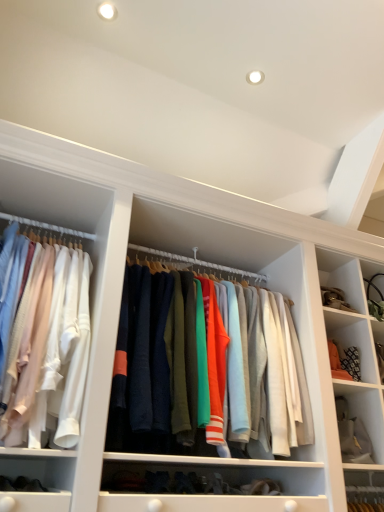
Question: Is there a large distance between white fabric at lower right and knit sweater at center, which is the 1th clothing from right to left?

Choices:
 (A) yes
 (B) no

Answer: (B)

Question: Does white fabric at lower right appear on the right side of knit sweater at center, which is the 1th clothing from right to left?

Choices:
 (A) no
 (B) yes

Answer: (B)

Question: Is white fabric at lower right next to knit sweater at center, placed as the second clothing when sorted from left to right, and touching it?

Choices:
 (A) yes
 (B) no

Answer: (B)

Question: Is white fabric at lower right taller than knit sweater at center, which is the 1th clothing from right to left?

Choices:
 (A) no
 (B) yes

Answer: (A)

Question: From a real-world perspective, does white fabric at lower right stand above knit sweater at center, which is the 1th clothing from right to left?

Choices:
 (A) yes
 (B) no

Answer: (B)

Question: Considering the relative sizes of white fabric at lower right and knit sweater at center, which is the 1th clothing from right to left, in the image provided, is white fabric at lower right bigger than knit sweater at center, which is the 1th clothing from right to left,?

Choices:
 (A) no
 (B) yes

Answer: (A)

Question: Can you confirm if matte white shirts at left, which is counted as the second clothing, starting from the right, is bigger than white fabric at lower right?

Choices:
 (A) yes
 (B) no

Answer: (A)

Question: Can you confirm if matte white shirts at left, acting as the first clothing starting from the left, is wider than white fabric at lower right?

Choices:
 (A) yes
 (B) no

Answer: (A)

Question: Does matte white shirts at left, which is counted as the second clothing, starting from the right, contain white fabric at lower right?

Choices:
 (A) no
 (B) yes

Answer: (A)

Question: Are matte white shirts at left, which is counted as the second clothing, starting from the right, and white fabric at lower right beside each other?

Choices:
 (A) no
 (B) yes

Answer: (A)

Question: Is white fabric at lower right at the back of matte white shirts at left, acting as the first clothing starting from the left?

Choices:
 (A) no
 (B) yes

Answer: (A)

Question: From the image's perspective, is matte white shirts at left, acting as the first clothing starting from the left, over white fabric at lower right?

Choices:
 (A) no
 (B) yes

Answer: (B)

Question: Is white fabric at lower right smaller than matte white shirts at left, which is counted as the second clothing, starting from the right?

Choices:
 (A) no
 (B) yes

Answer: (B)